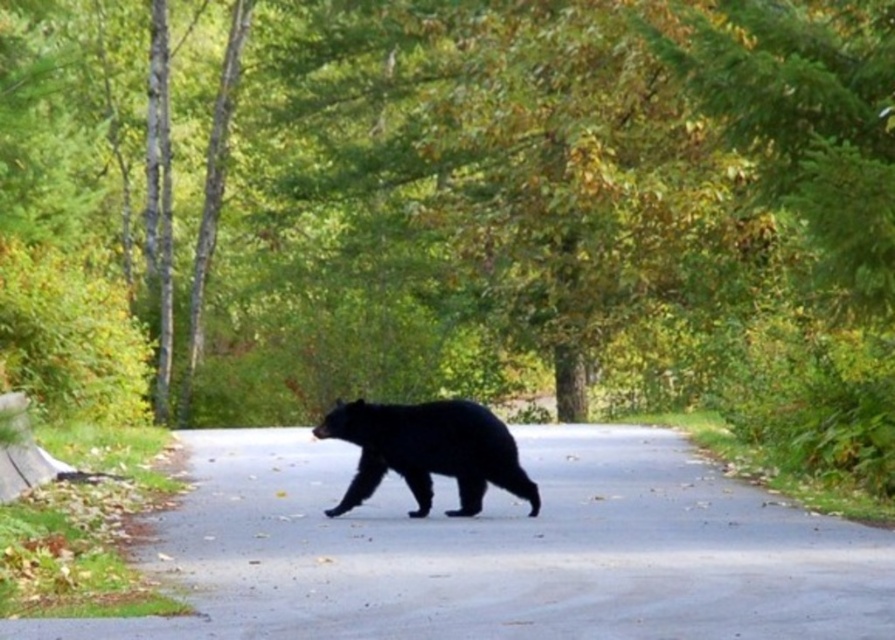
You are standing at point (499, 550) in the forest scene. What object are you directly on?

You are directly on the black asphalt road at center.

You are driving a car and see the image. You need to stop your car before hitting the black fur bear at center. The black asphalt road at center is under the bear. How can you stop your car in time?

The black asphalt road at center is positioned under the black fur bear at center, meaning the bear is on the road. To stop in time, you should immediately brake hard since the bear is directly on the road ahead.

You are driving a car that is 1.8 meters wide. You see the black asphalt road at center and the black fur bear at center. Can your car safely pass through the space between them without hitting the bear?

The black asphalt road at center is 2.15 meters away from the black fur bear at center. Since your car is 1.8 meters wide, it can safely pass through the space between them without hitting the bear.